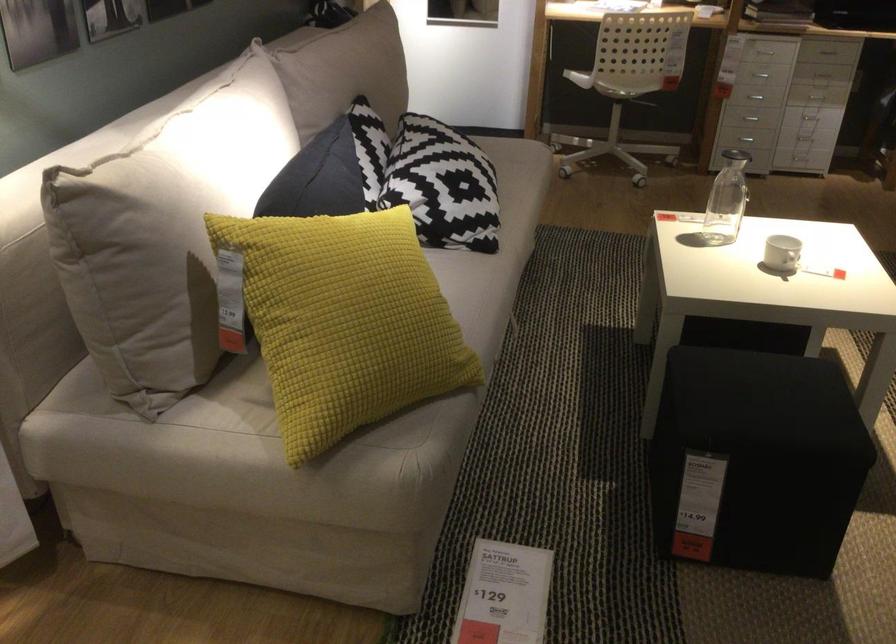
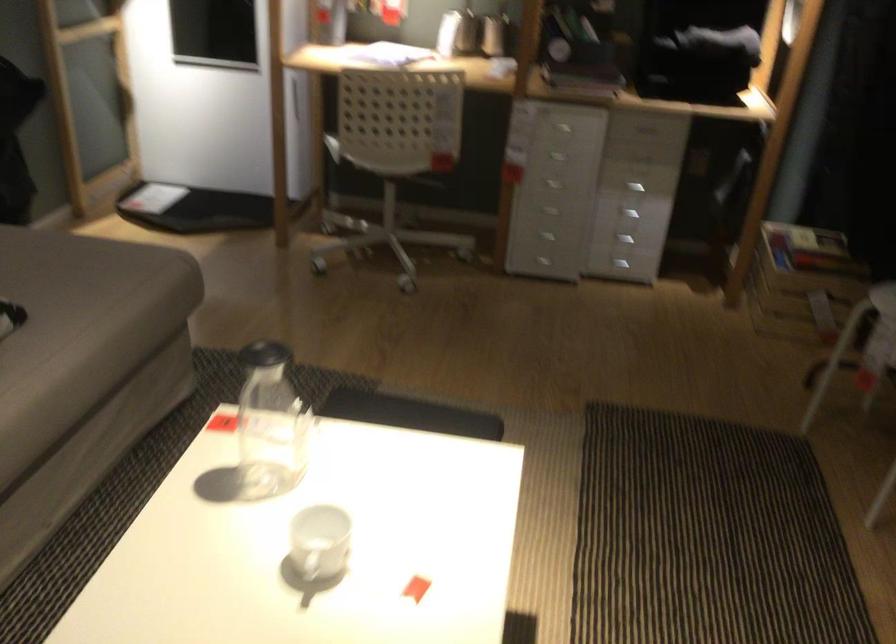
Locate, in the second image, the point that corresponds to (823,100) in the first image.

(627, 214)